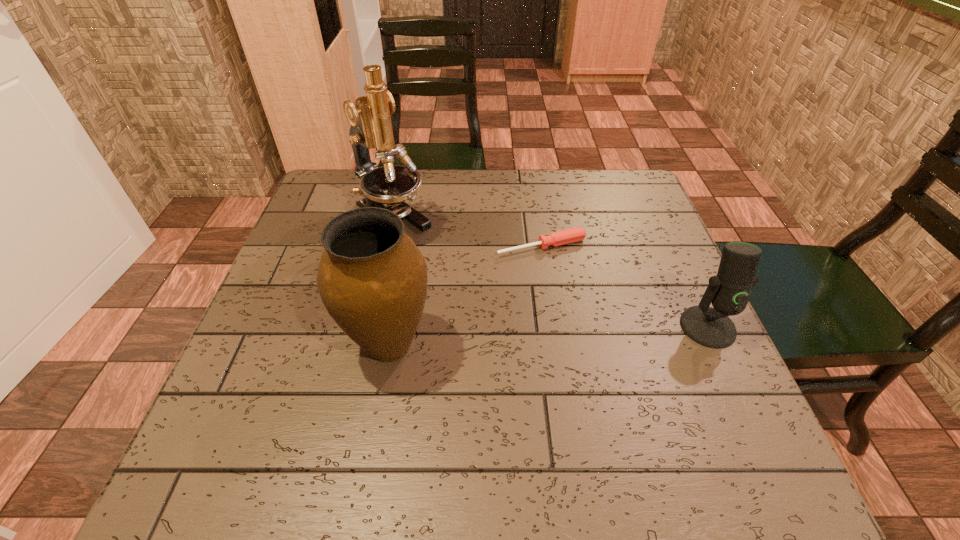
Where is `vacant space on the desktop that is between the second tallest object and the second shortest object and is positioned at the eyepiece of the tallest object`? Image resolution: width=960 pixels, height=540 pixels. vacant space on the desktop that is between the second tallest object and the second shortest object and is positioned at the eyepiece of the tallest object is located at coordinates (537, 336).

The height and width of the screenshot is (540, 960). What are the coordinates of `vacant spot on the desktop that is between the urn and the microphone and is positioned at the blade of the shortest object` in the screenshot? It's located at (599, 333).